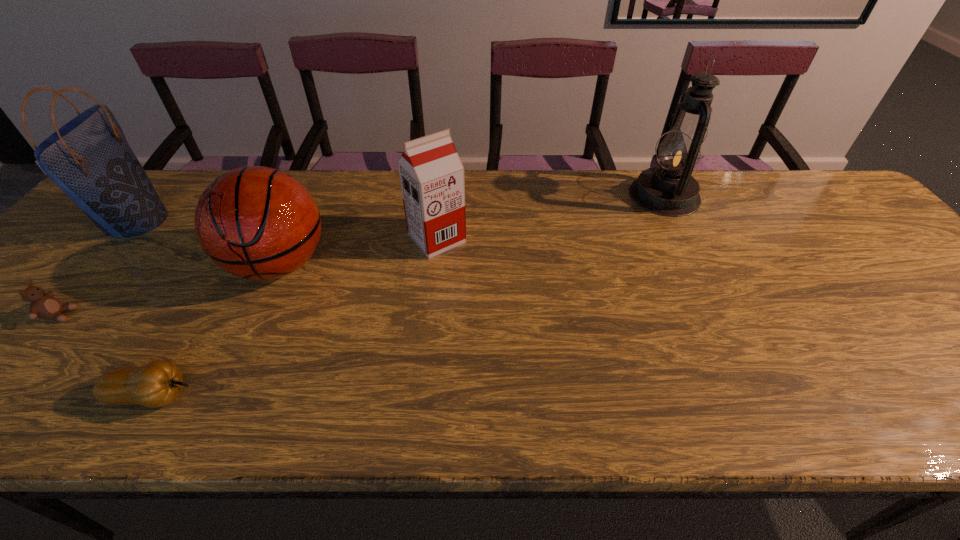
This screenshot has height=540, width=960. I want to click on vacant region between the shopping bag and the teddy bear, so click(98, 267).

Where is `free spot between the basketball and the teddy bear`? free spot between the basketball and the teddy bear is located at coordinates (170, 289).

Identify which object is the third closest to the fifth object from left to right. Please provide its 2D coordinates. Your answer should be formatted as a tuple, i.e. [(x, y)], where the tuple contains the x and y coordinates of a point satisfying the conditions above.

[(158, 383)]

At what (x,y) coordinates should I click in order to perform the action: click on the third closest object to the nearest object. Please return your answer as a coordinate pair (x, y). The image size is (960, 540). Looking at the image, I should click on (89, 158).

This screenshot has height=540, width=960. What are the coordinates of `blank space that satisfies the following two spatial constraints: 1. on the front side of the rightmost object; 2. on the front-facing side of the teddy bear` in the screenshot? It's located at (723, 315).

Locate an element on the screen. Image resolution: width=960 pixels, height=540 pixels. vacant area that satisfies the following two spatial constraints: 1. on the side with spill of the basketball; 2. on the stem side of the nearest object is located at coordinates coord(220,396).